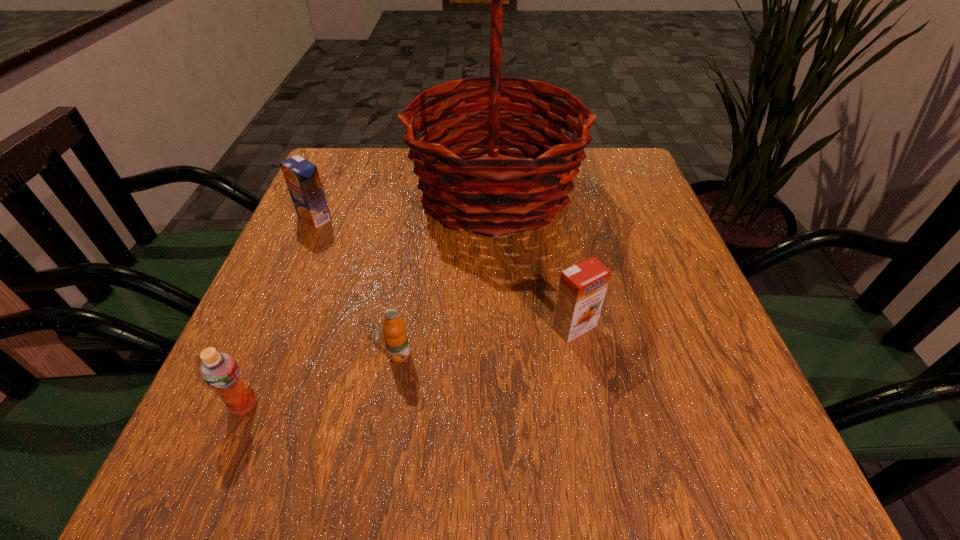
Locate an element on the screen. basket is located at coordinates (465, 188).

Image resolution: width=960 pixels, height=540 pixels. I want to click on the farthest orange juice, so click(x=302, y=178).

Where is `the rightmost orange juice`? the rightmost orange juice is located at coordinates (582, 287).

Locate an element on the screen. The image size is (960, 540). the third nearest orange juice is located at coordinates (582, 287).

In order to click on the nearest object in this screenshot , I will do `click(220, 371)`.

Identify the location of the second nearest orange juice. (395, 336).

Find the location of a particular element. This screenshot has width=960, height=540. the shortest orange juice is located at coordinates (395, 336).

In order to click on vacant space located 0.230m on the front of the tallest object in this screenshot , I will do `click(501, 335)`.

You are a GUI agent. You are given a task and a screenshot of the screen. Output one action in this format:
    pyautogui.click(x=<x>, y=<y>)
    Task: Click on the vacant area situated on the back of the farthest orange juice
    This screenshot has height=540, width=960.
    Given the screenshot: What is the action you would take?
    pyautogui.click(x=345, y=148)

Where is `free space located on the front of the third farthest object`? free space located on the front of the third farthest object is located at coordinates (590, 413).